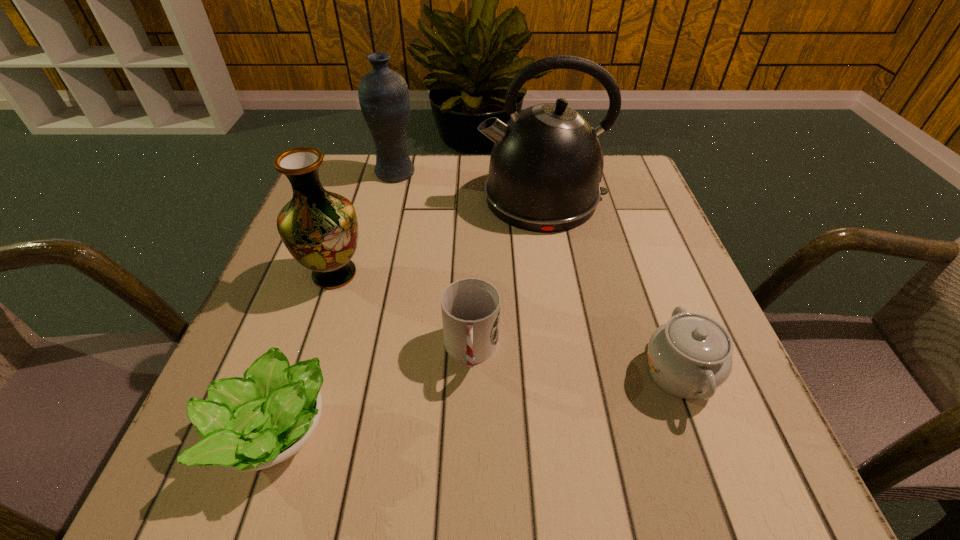
The height and width of the screenshot is (540, 960). What are the coordinates of `object positioned at the near left corner` in the screenshot? It's located at 248,424.

At what (x,y) coordinates should I click in order to perform the action: click on object situated at the far right corner. Please return your answer as a coordinate pair (x, y). The height and width of the screenshot is (540, 960). Looking at the image, I should click on (546, 163).

Locate an element on the screen. vacant space at the far edge is located at coordinates (410, 190).

Where is `blank area at the near edge`? The height and width of the screenshot is (540, 960). blank area at the near edge is located at coordinates (545, 496).

Locate an element on the screen. The height and width of the screenshot is (540, 960). vacant space at the left edge of the desktop is located at coordinates (269, 311).

At what (x,y) coordinates should I click in order to perform the action: click on free region at the right edge of the desktop. Please return your answer as a coordinate pair (x, y). The image size is (960, 540). Looking at the image, I should click on (651, 265).

Where is `vacant region at the far left corner of the desktop`? The image size is (960, 540). vacant region at the far left corner of the desktop is located at coordinates (332, 172).

Identify the location of vacant space at the near left corner of the desktop. (297, 457).

In the image, there is a desktop. Where is `vacant space at the far right corner`? vacant space at the far right corner is located at coordinates (618, 168).

Find the location of `unoccupied area between the third farthest object and the chinaware`. unoccupied area between the third farthest object and the chinaware is located at coordinates (507, 323).